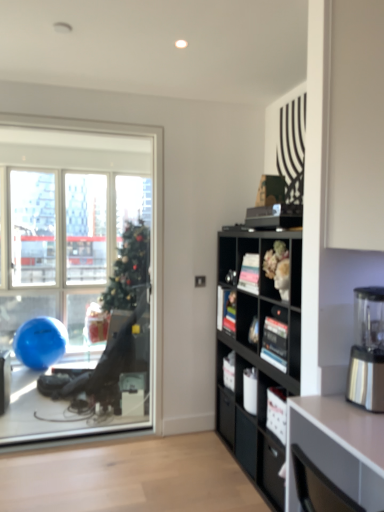
Question: From the image's perspective, is matte black bookshelf at center beneath transparent glass window at left?

Choices:
 (A) no
 (B) yes

Answer: (B)

Question: Does matte black bookshelf at center come behind transparent glass window at left?

Choices:
 (A) yes
 (B) no

Answer: (B)

Question: Can you confirm if matte black bookshelf at center is wider than transparent glass window at left?

Choices:
 (A) yes
 (B) no

Answer: (A)

Question: Does matte black bookshelf at center have a lesser width compared to transparent glass window at left?

Choices:
 (A) yes
 (B) no

Answer: (B)

Question: Does matte black bookshelf at center have a larger size compared to transparent glass window at left?

Choices:
 (A) yes
 (B) no

Answer: (B)

Question: From the image's perspective, is black matte bookshelf at center-right positioned above or below matte black bookshelf at center?

Choices:
 (A) below
 (B) above

Answer: (A)

Question: From a real-world perspective, is black matte bookshelf at center-right above or below matte black bookshelf at center?

Choices:
 (A) below
 (B) above

Answer: (A)

Question: In the image, is black matte bookshelf at center-right positioned in front of or behind matte black bookshelf at center?

Choices:
 (A) front
 (B) behind

Answer: (A)

Question: In the image, is black matte bookshelf at center-right on the left side or the right side of matte black bookshelf at center?

Choices:
 (A) left
 (B) right

Answer: (B)

Question: From the image's perspective, is transparent glass window at left located above or below black matte bookshelf at center-right?

Choices:
 (A) above
 (B) below

Answer: (A)

Question: From their relative heights in the image, would you say transparent glass window at left is taller or shorter than black matte bookshelf at center-right?

Choices:
 (A) short
 (B) tall

Answer: (B)

Question: From a real-world perspective, is transparent glass window at left physically located above or below black matte bookshelf at center-right?

Choices:
 (A) above
 (B) below

Answer: (A)

Question: Would you say transparent glass window at left is to the left or to the right of black matte bookshelf at center-right in the picture?

Choices:
 (A) left
 (B) right

Answer: (A)

Question: Considering the positions of matte black bookshelf at center and white glossy desk at lower right in the image, is matte black bookshelf at center taller or shorter than white glossy desk at lower right?

Choices:
 (A) short
 (B) tall

Answer: (A)

Question: Considering their positions, is matte black bookshelf at center located in front of or behind white glossy desk at lower right?

Choices:
 (A) behind
 (B) front

Answer: (A)